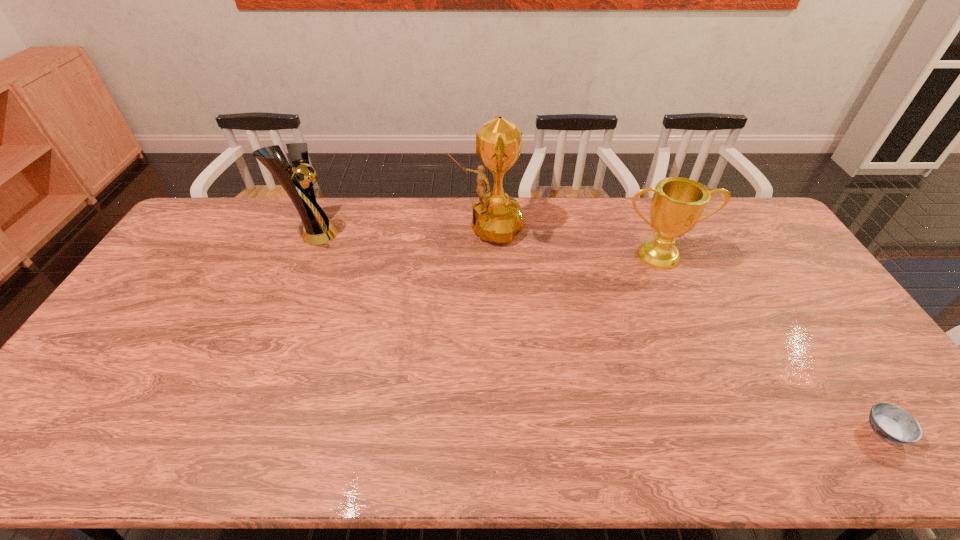
The image size is (960, 540). I want to click on blank area in the image that satisfies the following two spatial constraints: 1. at the front of the leftmost object, where the globe is visible; 2. on the left side of the ashtray, so click(x=230, y=431).